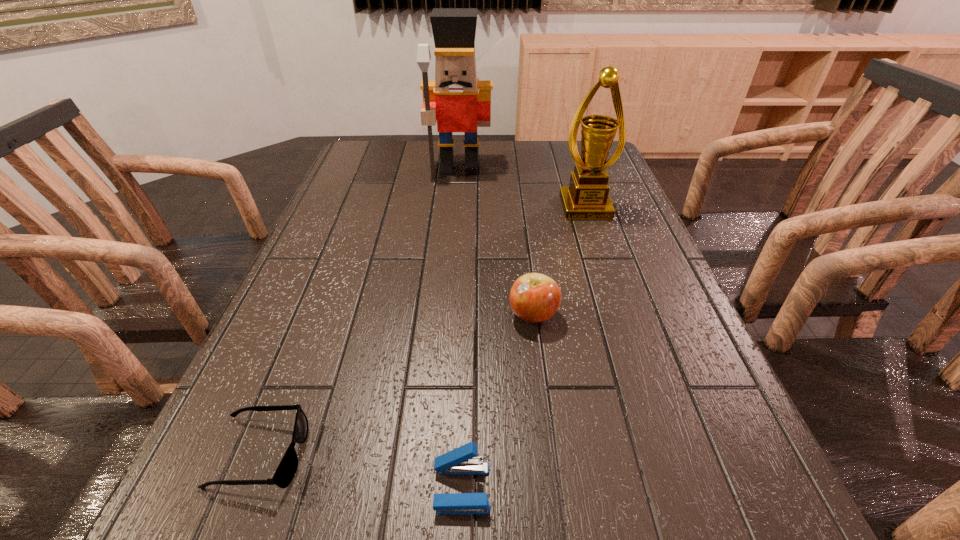
The width and height of the screenshot is (960, 540). In the image, there is a desktop. What are the coordinates of `vacant space at the far left corner` in the screenshot? It's located at (386, 171).

Identify the location of empty space between the apple and the second tallest object. The height and width of the screenshot is (540, 960). (559, 261).

Where is `vacant space that is in between the farthest object and the leftmost object`? vacant space that is in between the farthest object and the leftmost object is located at coordinates (359, 312).

Where is `vacant area that lies between the nutcracker and the stapler`? This screenshot has height=540, width=960. vacant area that lies between the nutcracker and the stapler is located at coordinates (460, 328).

The height and width of the screenshot is (540, 960). I want to click on empty space between the nutcracker and the second tallest object, so click(x=522, y=188).

At what (x,y) coordinates should I click in order to perform the action: click on vacant area between the leftmost object and the award. Please return your answer as a coordinate pair (x, y). The height and width of the screenshot is (540, 960). Looking at the image, I should click on (422, 330).

Where is `unoccupied area between the fourth tallest object and the sunglasses`? This screenshot has height=540, width=960. unoccupied area between the fourth tallest object and the sunglasses is located at coordinates (361, 471).

Image resolution: width=960 pixels, height=540 pixels. In order to click on free point between the farthest object and the stapler in this screenshot , I will do `click(460, 328)`.

This screenshot has width=960, height=540. In order to click on vacant area that lies between the shortest object and the second farthest object in this screenshot , I will do `click(422, 330)`.

Locate an element on the screen. unoccupied area between the second shortest object and the nutcracker is located at coordinates (460, 328).